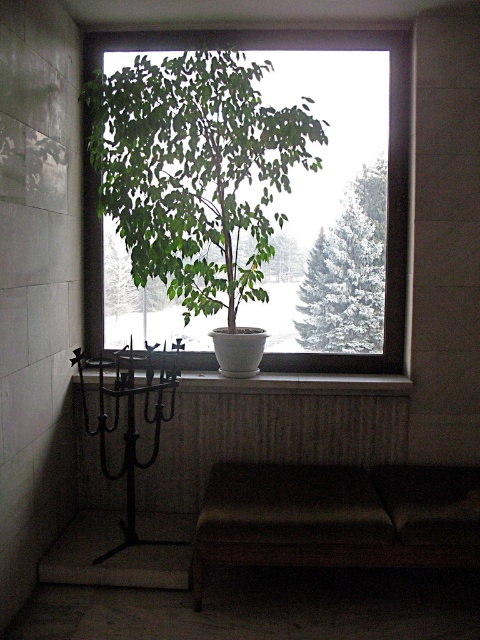
At what (x,y) coordinates should I click in order to perform the action: click on green matte tree at center. Please return your answer as a coordinate pair (x, y). The height and width of the screenshot is (640, 480). Looking at the image, I should click on (348, 273).

Does point (323, 323) come in front of point (139, 540)?

No, it is not.

Does point (377, 160) come behind point (103, 378)?

Yes, it is behind point (103, 378).

Locate an element on the screen. The image size is (480, 640). green matte tree at center is located at coordinates (348, 273).

The image size is (480, 640). What do you see at coordinates (348, 273) in the screenshot?
I see `green matte tree at center` at bounding box center [348, 273].

Between point (381, 180) and point (266, 372), which one is positioned behind?

Positioned behind is point (266, 372).

Where is `green matte tree at center`? This screenshot has height=640, width=480. green matte tree at center is located at coordinates (348, 273).

You are a GUI agent. You are given a task and a screenshot of the screen. Output one action in this format:
    pyautogui.click(x=<x>, y=<y>)
    Task: Click on the green matte tree at center
    Image resolution: width=480 pixels, height=640 pixels.
    Given the screenshot: What is the action you would take?
    pyautogui.click(x=348, y=273)

From the picture: Is white ceramic plant at center thinner than white ceramic pot at center?

Incorrect, white ceramic plant at center's width is not less than white ceramic pot at center's.

Who is lower down, white ceramic plant at center or white ceramic pot at center?

white ceramic pot at center is below.

Who is more forward, (169,198) or (96,380)?

Positioned in front is point (169,198).

In order to click on white ceramic plant at center in this screenshot , I will do `click(254, 193)`.